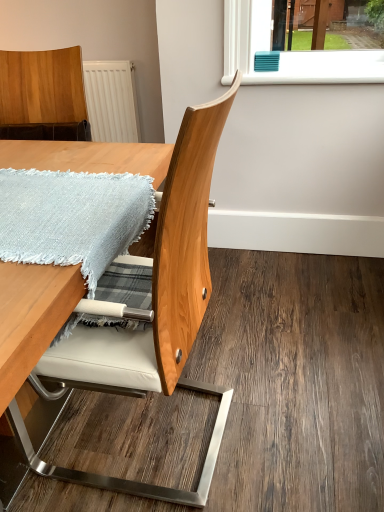
Question: Considering the relative sizes of wooden chair at center and white plastic window sill at upper center in the image provided, is wooden chair at center taller than white plastic window sill at upper center?

Choices:
 (A) yes
 (B) no

Answer: (A)

Question: Is wooden chair at center touching white plastic window sill at upper center?

Choices:
 (A) no
 (B) yes

Answer: (A)

Question: From a real-world perspective, does wooden chair at center sit lower than white plastic window sill at upper center?

Choices:
 (A) yes
 (B) no

Answer: (A)

Question: Is wooden chair at center outside white plastic window sill at upper center?

Choices:
 (A) no
 (B) yes

Answer: (B)

Question: Can you confirm if wooden chair at center is positioned to the right of white plastic window sill at upper center?

Choices:
 (A) no
 (B) yes

Answer: (A)

Question: From the image's perspective, does wooden chair at center appear lower than white plastic window sill at upper center?

Choices:
 (A) no
 (B) yes

Answer: (B)

Question: Is white plastic window sill at upper center completely or partially outside of wooden table at center?

Choices:
 (A) yes
 (B) no

Answer: (A)

Question: Is white plastic window sill at upper center at the left side of wooden table at center?

Choices:
 (A) yes
 (B) no

Answer: (B)

Question: Is white plastic window sill at upper center with wooden table at center?

Choices:
 (A) no
 (B) yes

Answer: (A)

Question: Is white plastic window sill at upper center in front of wooden table at center?

Choices:
 (A) no
 (B) yes

Answer: (A)

Question: Is white plastic window sill at upper center thinner than wooden table at center?

Choices:
 (A) no
 (B) yes

Answer: (B)

Question: Can you confirm if white plastic window sill at upper center is shorter than wooden table at center?

Choices:
 (A) no
 (B) yes

Answer: (B)

Question: Is wooden table at center looking in the opposite direction of wooden chair at center?

Choices:
 (A) no
 (B) yes

Answer: (B)